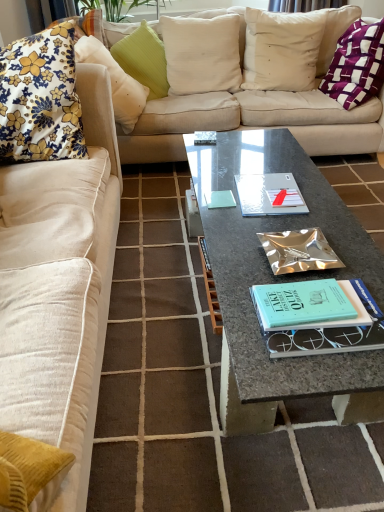
Where is `free point below silver metallic notebook at center (from a real-world perspective)`? free point below silver metallic notebook at center (from a real-world perspective) is located at coordinates 255,198.